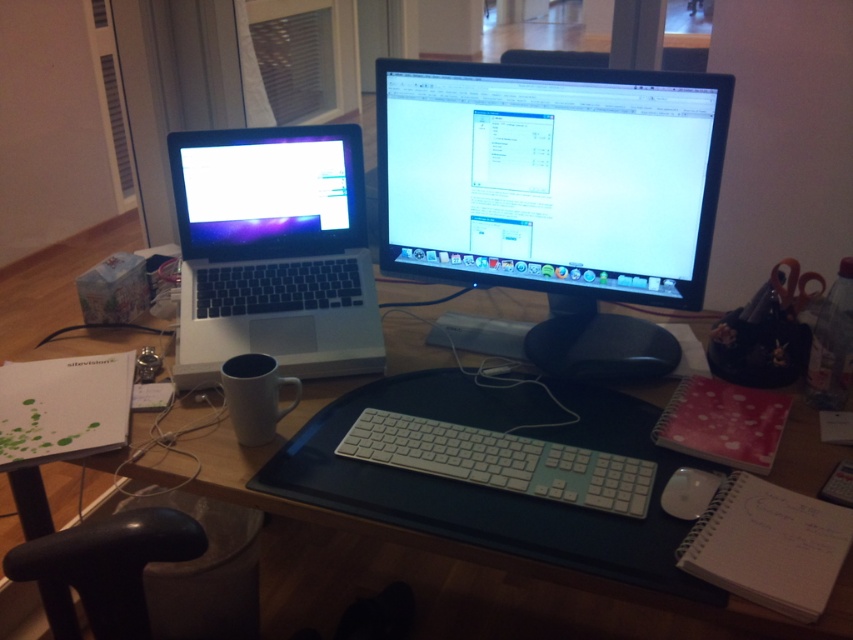
Question: Does white matte coffee cup at lower left appear on the left side of white plastic mouse at lower right?

Choices:
 (A) no
 (B) yes

Answer: (B)

Question: Which point is farther from the camera taking this photo?

Choices:
 (A) (260, 140)
 (B) (238, 429)
 (C) (523, 486)

Answer: (A)

Question: Which of the following is the farthest from the observer?

Choices:
 (A) sleek silver laptop at left
 (B) matte black laptop at left

Answer: (B)

Question: Can you confirm if wooden desk at center is smaller than white plastic keyboard at center?

Choices:
 (A) no
 (B) yes

Answer: (A)

Question: Can you confirm if wooden desk at center is wider than white plastic mouse at lower right?

Choices:
 (A) yes
 (B) no

Answer: (A)

Question: Which point is farther from the camera taking this photo?

Choices:
 (A) (602, 621)
 (B) (699, 497)
 (C) (225, 371)

Answer: (A)